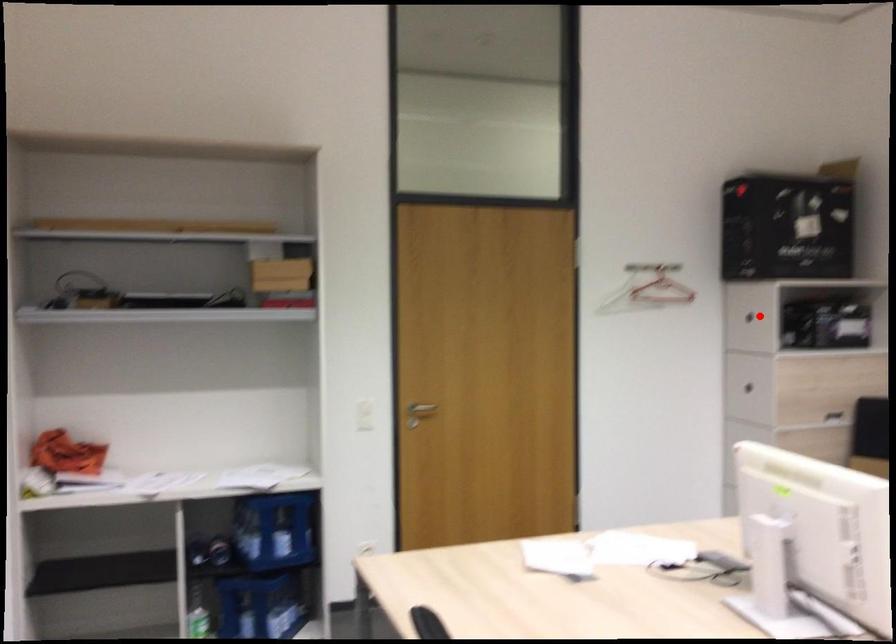
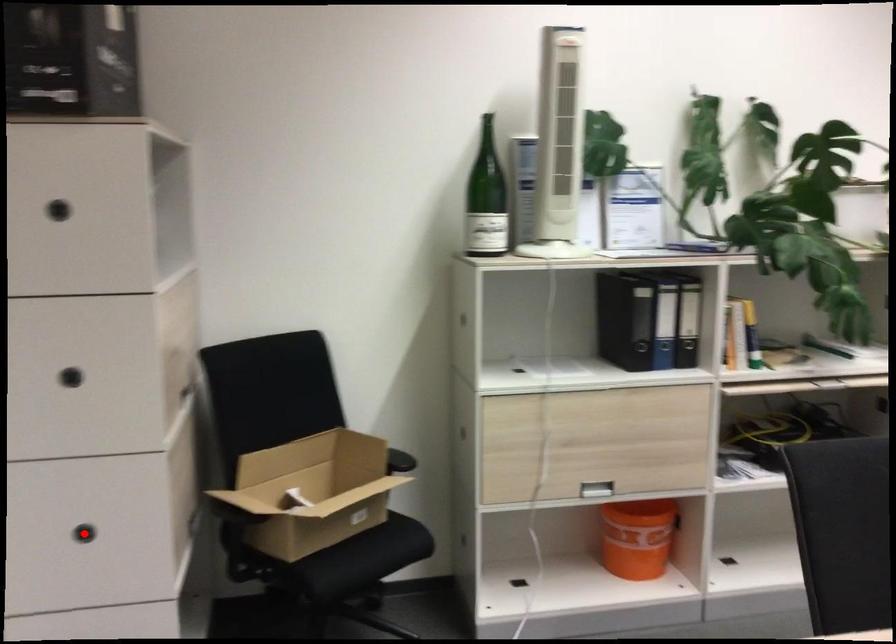
I am providing you with two images of the same scene from different viewpoints. A red point is marked on the first image and another point is marked on the second image. Is the marked point in image1 the same physical position as the marked point in image2?

No